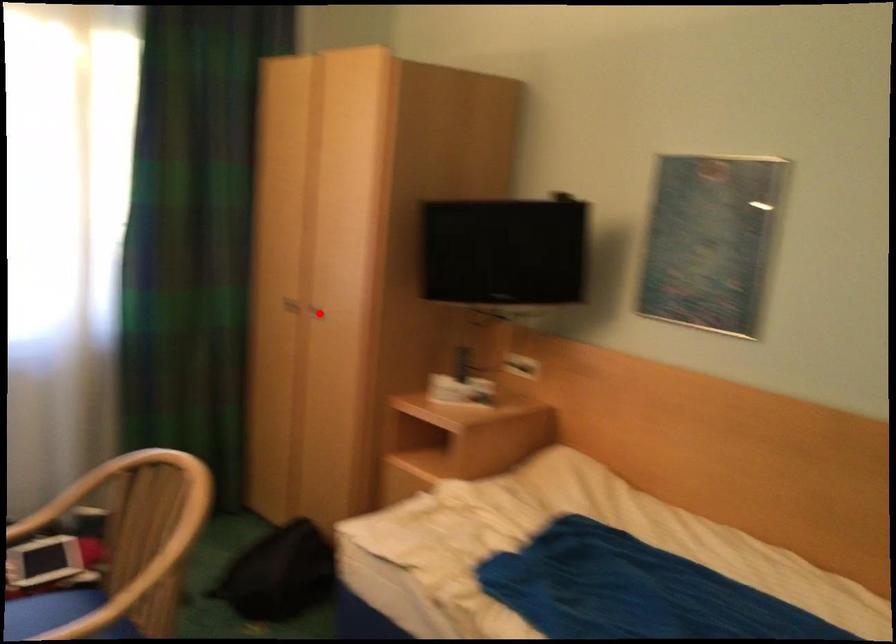
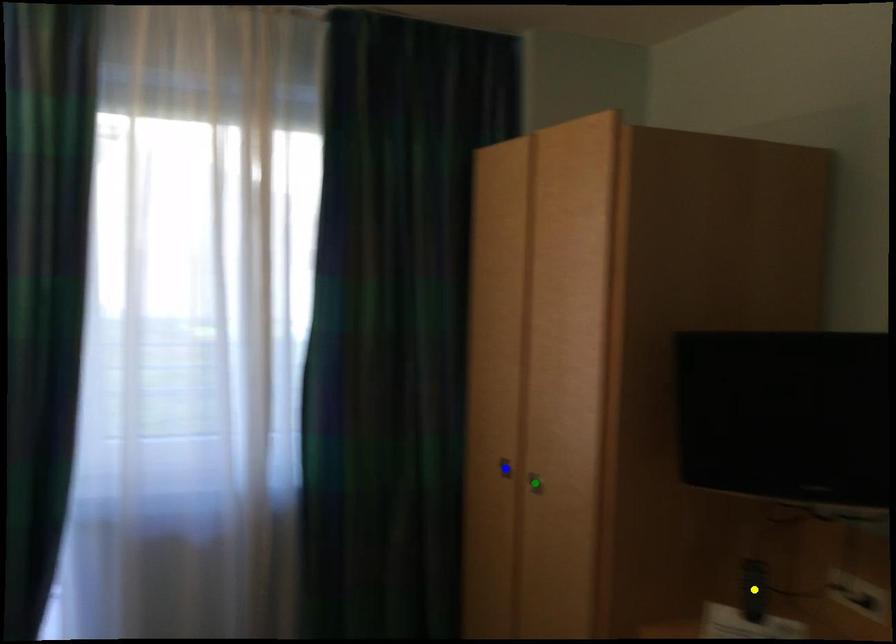
Question: I am providing you with two images of the same scene from different viewpoints. A red point is marked on the first image. You are given multiple points on the second image. Can you choose the point in image 2 that corresponds to the point in image 1?

Choices:
 (A) green point
 (B) yellow point
 (C) blue point

Answer: (A)